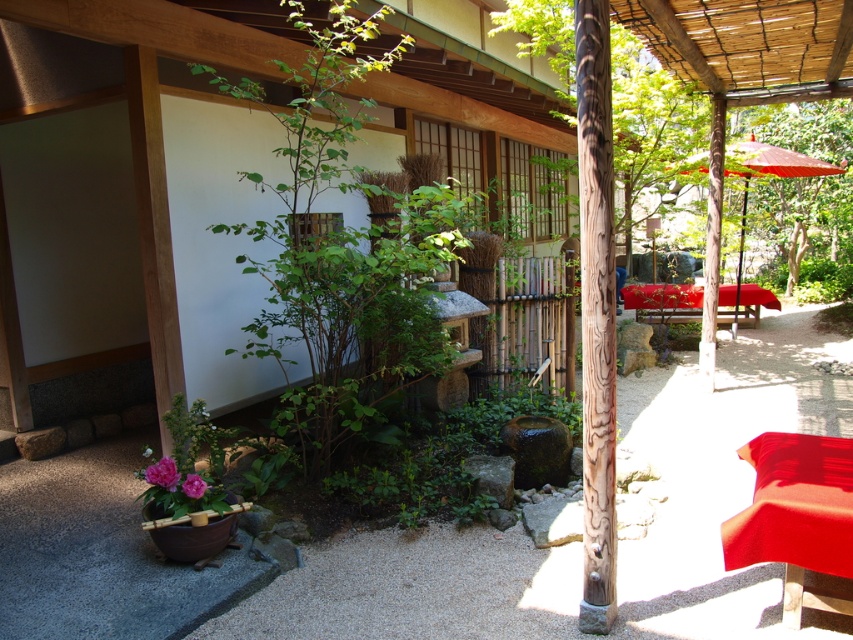
You are standing at the entrance of the Japanese garden and want to walk towards the first point you see. Which point, point (334, 60) or point (792, 192), is closer to you?

Point (334, 60) is in front of point (792, 192), so it is closer to you.

You are planning to place a new decorative item in the Japanese garden scene. The item is 1.2 meters wide. You see the green leafy tree at upper right and the red fabric umbrella at upper right. Which object can the new item fit next to without overlapping?

The new item can fit next to the red fabric umbrella at upper right because it has a greater width compared to the green leafy tree at upper right, providing more space.

You are a visitor in a Japanese garden and want to take a photo of both the green leafy plant at center and the green leafy tree at upper right. Which object should you focus on first if you want to capture both in a single frame without moving your camera?

You should focus on the green leafy plant at center first because it is positioned on the left side of the green leafy tree at upper right, so adjusting the camera to include both would require framing from the left to the right side.